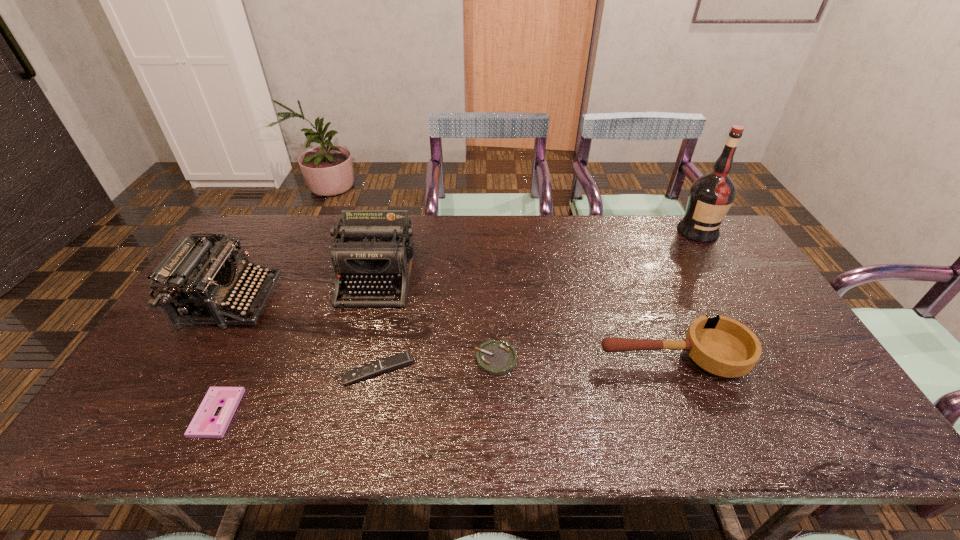
This screenshot has height=540, width=960. I want to click on the tallest object, so click(711, 195).

The image size is (960, 540). What are the coordinates of `the rightmost object` in the screenshot? It's located at (711, 195).

You are a GUI agent. You are given a task and a screenshot of the screen. Output one action in this format:
    pyautogui.click(x=<x>, y=<y>)
    Task: Click on the right typewriter
    
    Given the screenshot: What is the action you would take?
    pyautogui.click(x=376, y=247)

In order to click on the left typewriter in this screenshot , I will do `click(197, 282)`.

This screenshot has width=960, height=540. I want to click on the sixth object from left to right, so click(x=722, y=346).

This screenshot has width=960, height=540. In order to click on the fourth tallest object in this screenshot , I will do `click(722, 346)`.

Where is `the third object from right to left`? Image resolution: width=960 pixels, height=540 pixels. the third object from right to left is located at coordinates (498, 358).

Locate an element on the screen. The height and width of the screenshot is (540, 960). remote control is located at coordinates (394, 362).

I want to click on videotape, so click(x=201, y=426).

Locate an element on the screen. the nearest object is located at coordinates (201, 426).